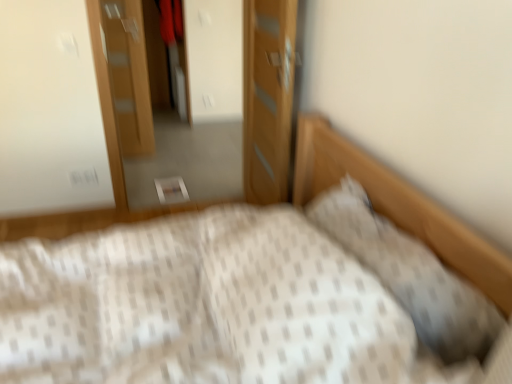
Question: From the image's perspective, is wooden dresser at center located beneath white textured bed at center?

Choices:
 (A) no
 (B) yes

Answer: (A)

Question: Can you confirm if wooden dresser at center is smaller than white textured bed at center?

Choices:
 (A) yes
 (B) no

Answer: (A)

Question: Considering the relative positions of wooden dresser at center and white textured bed at center in the image provided, is wooden dresser at center in front of white textured bed at center?

Choices:
 (A) no
 (B) yes

Answer: (A)

Question: Can you confirm if wooden dresser at center is bigger than white textured bed at center?

Choices:
 (A) no
 (B) yes

Answer: (A)

Question: Is wooden dresser at center far away from white textured bed at center?

Choices:
 (A) yes
 (B) no

Answer: (A)

Question: Relative to wooden door at upper left, which appears as the first door when viewed from the back, is wooden door at center, the 2th door from the left, in front or behind?

Choices:
 (A) front
 (B) behind

Answer: (A)

Question: Is wooden door at center, the 2th door from the left, situated inside wooden door at upper left, the second door viewed from the right, or outside?

Choices:
 (A) inside
 (B) outside

Answer: (B)

Question: Considering the relative positions of wooden door at center, which is the 2th door in back-to-front order, and wooden door at upper left, which appears as the first door when viewed from the back, in the image provided, is wooden door at center, which is the 2th door in back-to-front order, to the left or to the right of wooden door at upper left, which appears as the first door when viewed from the back,?

Choices:
 (A) left
 (B) right

Answer: (B)

Question: Is point 244,26 positioned closer to the camera than point 108,54?

Choices:
 (A) farther
 (B) closer

Answer: (B)

Question: From the image's perspective, is wooden door at upper left, arranged as the 2th door when viewed from the front, located above or below white textured pillow at upper right?

Choices:
 (A) above
 (B) below

Answer: (A)

Question: Based on their positions, is wooden door at upper left, acting as the 1th door starting from the left, located to the left or right of white textured pillow at upper right?

Choices:
 (A) left
 (B) right

Answer: (A)

Question: Do you think wooden door at upper left, acting as the 1th door starting from the left, is within white textured pillow at upper right, or outside of it?

Choices:
 (A) outside
 (B) inside

Answer: (A)

Question: From a real-world perspective, is wooden door at upper left, which appears as the first door when viewed from the back, above or below white textured pillow at upper right?

Choices:
 (A) below
 (B) above

Answer: (A)

Question: From a real-world perspective, is wooden dresser at center physically located above or below white textured pillow at upper right?

Choices:
 (A) above
 (B) below

Answer: (B)

Question: Is wooden dresser at center bigger or smaller than white textured pillow at upper right?

Choices:
 (A) small
 (B) big

Answer: (B)